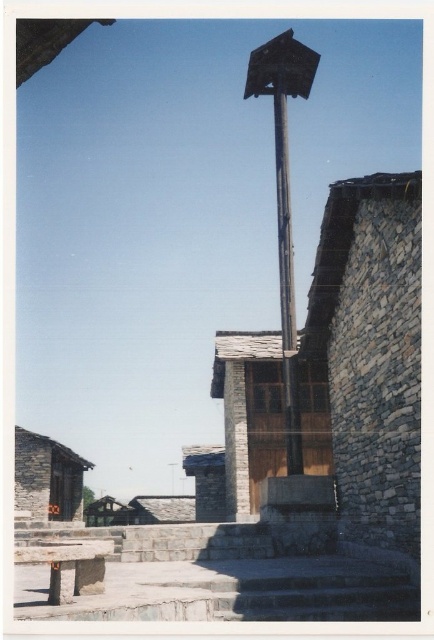
Is wooden hut at center positioned at the back of wooden hut at lower left?

No, wooden hut at center is closer to the viewer.

Which is more to the left, wooden hut at center or wooden hut at lower left?

wooden hut at lower left is more to the left.

What do you see at coordinates (249, 413) in the screenshot? The height and width of the screenshot is (640, 434). I see `wooden hut at center` at bounding box center [249, 413].

You are a GUI agent. You are given a task and a screenshot of the screen. Output one action in this format:
    pyautogui.click(x=<x>, y=<y>)
    Task: Click on the wooden hut at center
    The image size is (434, 640).
    Given the screenshot: What is the action you would take?
    pyautogui.click(x=249, y=413)

Does wooden hut at lower left have a smaller size compared to smooth stone pillar at center?

Actually, wooden hut at lower left might be larger than smooth stone pillar at center.

Can you confirm if wooden hut at lower left is positioned below smooth stone pillar at center?

Yes, wooden hut at lower left is below smooth stone pillar at center.

Is point (39, 458) closer to camera compared to point (239, 518)?

No, it is not.

You are a GUI agent. You are given a task and a screenshot of the screen. Output one action in this format:
    pyautogui.click(x=<x>, y=<y>)
    Task: Click on the wooden hut at lower left
    
    Given the screenshot: What is the action you would take?
    pyautogui.click(x=48, y=477)

Can you confirm if wooden post at center is smaller than smooth stone pillar at center?

Actually, wooden post at center might be larger than smooth stone pillar at center.

Which is more to the left, wooden post at center or smooth stone pillar at center?

smooth stone pillar at center

Which is behind, point (302, 58) or point (226, 445)?

Positioned behind is point (226, 445).

Locate an element on the screen. This screenshot has width=434, height=640. wooden post at center is located at coordinates (285, 198).